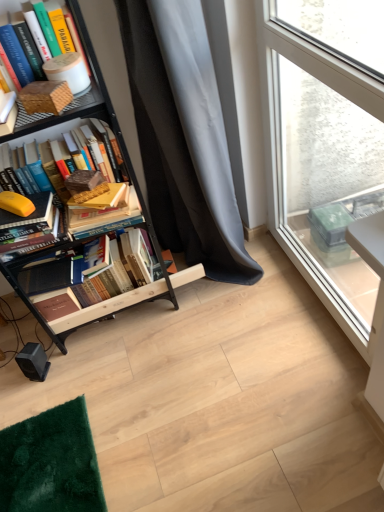
You are a GUI agent. You are given a task and a screenshot of the screen. Output one action in this format:
    pyautogui.click(x=<x>, y=<y>)
    Task: Click on the free space on the front side of gray fabric curtain at center
    Image resolution: width=384 pixels, height=512 pixels.
    Given the screenshot: What is the action you would take?
    pyautogui.click(x=249, y=353)